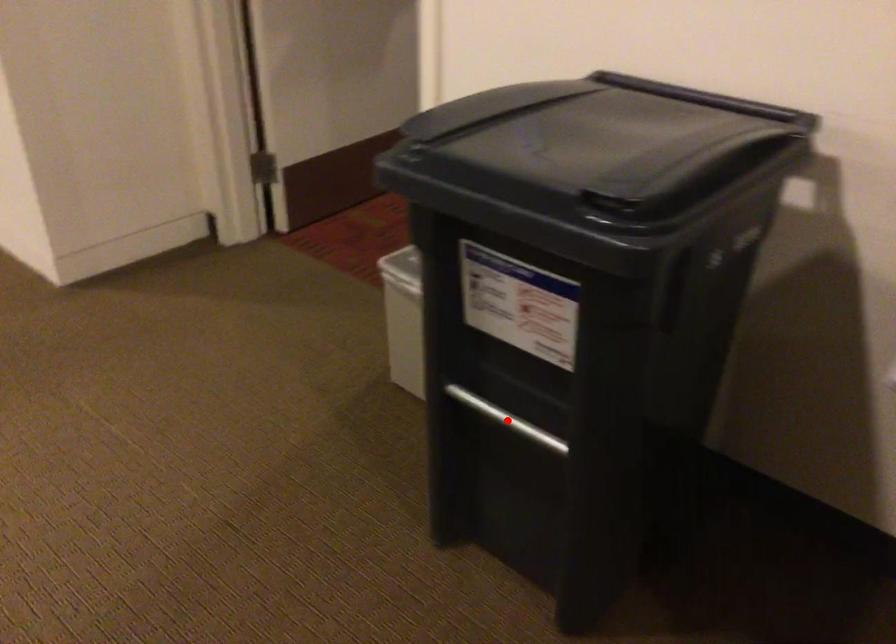
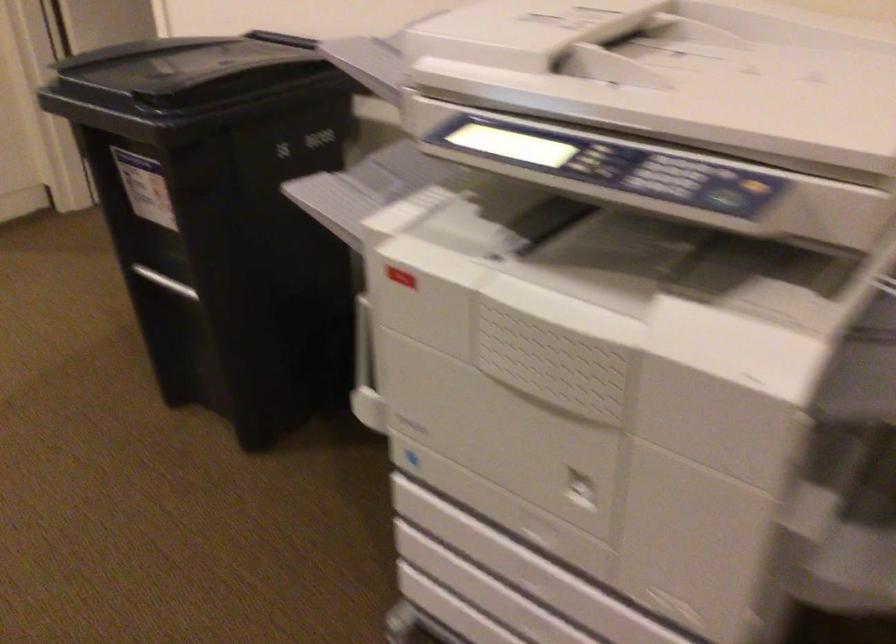
The point at the highlighted location is marked in the first image. Where is the corresponding point in the second image?

(165, 281)